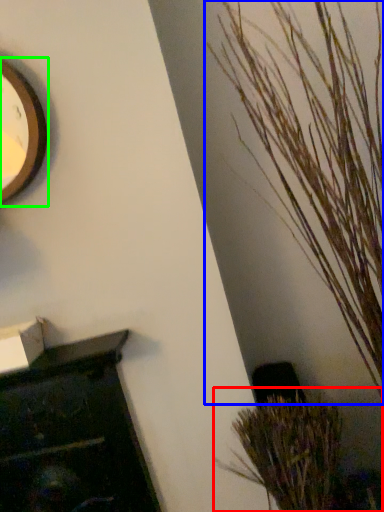
Question: Considering the real-world distances, which object is closest to houseplant (highlighted by a red box)? houseplant (highlighted by a blue box) or clock (highlighted by a green box).

Choices:
 (A) houseplant
 (B) clock

Answer: (A)